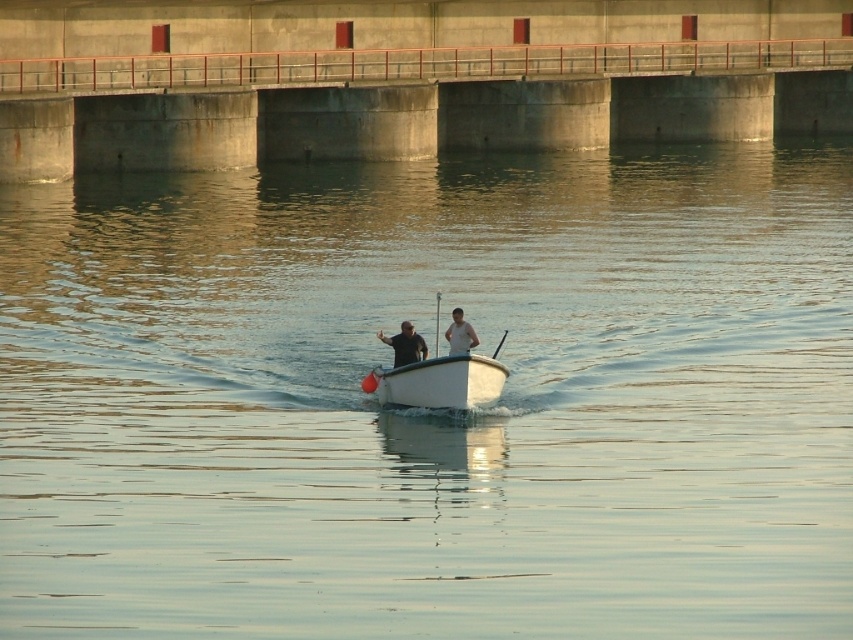
Question: From the image, what is the correct spatial relationship of black matte shirt at center in relation to white matte shirt at center?

Choices:
 (A) left
 (B) right

Answer: (A)

Question: Which point appears farthest from the camera in this image?

Choices:
 (A) (422, 378)
 (B) (397, 336)

Answer: (B)

Question: Among these objects, which one is nearest to the camera?

Choices:
 (A) white plastic boat at center
 (B) white matte shirt at center
 (C) black matte shirt at center

Answer: (A)

Question: Considering the relative positions of black matte shirt at center and white matte shirt at center in the image provided, where is black matte shirt at center located with respect to white matte shirt at center?

Choices:
 (A) right
 (B) left

Answer: (B)

Question: Based on their relative distances, which object is farther from the black matte shirt at center?

Choices:
 (A) white plastic boat at center
 (B) white matte shirt at center

Answer: (B)

Question: Is white plastic boat at center wider than white matte shirt at center?

Choices:
 (A) yes
 (B) no

Answer: (A)